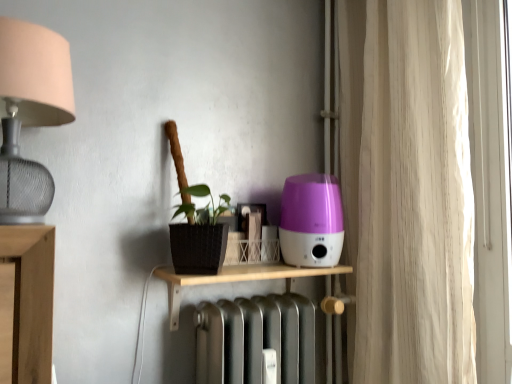
What is the approximate width of beige fabric curtain at right?

7.53 inches.

From the picture: In order to face purple glossy humidifier at center-right, should I rotate leftwards or rightwards?

Turn right approximately 7.288 degrees to face it.

Find the location of a particular element. The image size is (512, 384). matte silver lampshade at left is located at coordinates (30, 112).

This screenshot has height=384, width=512. Describe the element at coordinates (243, 280) in the screenshot. I see `wooden shelf at center` at that location.

In order to click on beige fabric curtain at right in this screenshot , I will do `click(407, 191)`.

Where is `lamp above the wooden shelf at center (from the image's perspective)`? The image size is (512, 384). lamp above the wooden shelf at center (from the image's perspective) is located at coordinates (30, 112).

Considering the sizes of objects matte silver lampshade at left and wooden shelf at center in the image provided, who is thinner, matte silver lampshade at left or wooden shelf at center?

wooden shelf at center.

Is matte silver lampshade at left aimed at wooden shelf at center?

No, matte silver lampshade at left is not aimed at wooden shelf at center.

From a real-world perspective, which object rests below the other?

wooden shelf at center.

From the image's perspective, is purple glossy humidifier at center-right located above or below matte silver lampshade at left?

purple glossy humidifier at center-right is situated lower than matte silver lampshade at left in the image.

Is purple glossy humidifier at center-right at the right side of matte silver lampshade at left?

Yes, purple glossy humidifier at center-right is to the right of matte silver lampshade at left.

Which of these two, purple glossy humidifier at center-right or matte silver lampshade at left, stands taller?

Standing taller between the two is matte silver lampshade at left.

Is purple glossy humidifier at center-right beside matte silver lampshade at left?

No, purple glossy humidifier at center-right is not beside matte silver lampshade at left.

Is purple glossy humidifier at center-right at the left side of wooden shelf at center?

Incorrect, purple glossy humidifier at center-right is not on the left side of wooden shelf at center.

From the image's perspective, which one is positioned lower, purple glossy humidifier at center-right or wooden shelf at center?

From the image's view, wooden shelf at center is below.

Does purple glossy humidifier at center-right have a lesser width compared to wooden shelf at center?

Yes.

Is purple glossy humidifier at center-right taller or shorter than wooden shelf at center?

Considering their sizes, purple glossy humidifier at center-right has more height than wooden shelf at center.

Considering the positions of point (343, 45) and point (13, 99), is point (343, 45) closer or farther from the camera than point (13, 99)?

Point (343, 45) appears to be farther away from the viewer than point (13, 99).

Is beige fabric curtain at right behind matte silver lampshade at left?

Yes, beige fabric curtain at right is further from the camera.

From a real-world perspective, is beige fabric curtain at right on matte silver lampshade at left?

Actually, beige fabric curtain at right is physically below matte silver lampshade at left in the real world.

Is matte silver lampshade at left outside of beige fabric curtain at right?

Absolutely, matte silver lampshade at left is external to beige fabric curtain at right.

Is matte silver lampshade at left taller or shorter than beige fabric curtain at right?

Clearly, matte silver lampshade at left is shorter compared to beige fabric curtain at right.

Is point (14, 142) closer to viewer compared to point (358, 306)?

Yes, it is.

Can you confirm if matte silver lampshade at left is positioned to the right of beige fabric curtain at right?

No, matte silver lampshade at left is not to the right of beige fabric curtain at right.

Which of these two, wooden shelf at center or matte silver lampshade at left, stands taller?

Standing taller between the two is matte silver lampshade at left.

From a real-world perspective, is wooden shelf at center positioned above or below matte silver lampshade at left?

From a real-world perspective, wooden shelf at center is physically below matte silver lampshade at left.

Considering the points (226, 276) and (32, 30), which point is behind, point (226, 276) or point (32, 30)?

Point (226, 276)

In terms of height, does purple glossy humidifier at center-right look taller or shorter compared to beige fabric curtain at right?

Considering their sizes, purple glossy humidifier at center-right has less height than beige fabric curtain at right.

Consider the image. From the image's perspective, which is below, purple glossy humidifier at center-right or beige fabric curtain at right?

From the image's view, purple glossy humidifier at center-right is below.

Where is `curtain above the purple glossy humidifier at center-right (from a real-world perspective)`? The height and width of the screenshot is (384, 512). curtain above the purple glossy humidifier at center-right (from a real-world perspective) is located at coordinates (407, 191).

Where is `lamp in front of the wooden shelf at center`? This screenshot has width=512, height=384. lamp in front of the wooden shelf at center is located at coordinates (30, 112).

Locate an element on the screen. Image resolution: width=512 pixels, height=384 pixels. appliance below the matte silver lampshade at left (from a real-world perspective) is located at coordinates (311, 221).

Based on their spatial positions, is matte silver lampshade at left or wooden shelf at center further from beige fabric curtain at right?

Based on the image, matte silver lampshade at left appears to be further to beige fabric curtain at right.

When comparing their distances from wooden shelf at center, does beige fabric curtain at right or matte silver lampshade at left seem further?

matte silver lampshade at left lies further to wooden shelf at center than the other object.

Based on the photo, based on their spatial positions, is purple glossy humidifier at center-right or beige fabric curtain at right further from wooden shelf at center?

Among the two, beige fabric curtain at right is located further to wooden shelf at center.

Looking at the image, which one is located closer to purple glossy humidifier at center-right, wooden shelf at center or matte silver lampshade at left?

The object closer to purple glossy humidifier at center-right is wooden shelf at center.

From the image, which object appears to be nearer to beige fabric curtain at right, matte silver lampshade at left or purple glossy humidifier at center-right?

purple glossy humidifier at center-right is positioned closer to the anchor beige fabric curtain at right.

From the image, which object appears to be farther from purple glossy humidifier at center-right, beige fabric curtain at right or wooden shelf at center?

beige fabric curtain at right lies further to purple glossy humidifier at center-right than the other object.

Considering their positions, is matte silver lampshade at left positioned further to wooden shelf at center than purple glossy humidifier at center-right?

Among the two, matte silver lampshade at left is located further to wooden shelf at center.

When comparing their distances from matte silver lampshade at left, does wooden shelf at center or beige fabric curtain at right seem closer?

Among the two, wooden shelf at center is located nearer to matte silver lampshade at left.

At what (x,y) coordinates should I click in order to perform the action: click on shelf between matte silver lampshade at left and beige fabric curtain at right from left to right. Please return your answer as a coordinate pair (x, y). The height and width of the screenshot is (384, 512). Looking at the image, I should click on (243, 280).

Image resolution: width=512 pixels, height=384 pixels. I want to click on shelf between matte silver lampshade at left and purple glossy humidifier at center-right, so click(243, 280).

The image size is (512, 384). I want to click on appliance between wooden shelf at center and beige fabric curtain at right from left to right, so click(311, 221).

Identify the location of appliance situated between matte silver lampshade at left and beige fabric curtain at right from left to right. This screenshot has width=512, height=384. (311, 221).